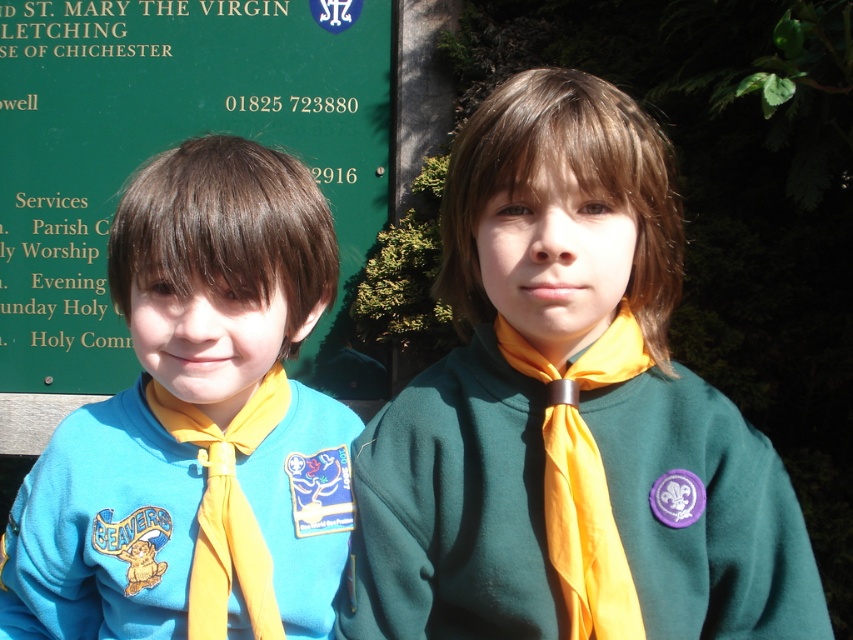
Identify the location of green fleece sweater at center. This screenshot has width=853, height=640. (567, 403).

Does green fleece sweater at center appear on the right side of yellow silky necktie at center?

Correct, you'll find green fleece sweater at center to the right of yellow silky necktie at center.

I want to click on green fleece sweater at center, so click(567, 403).

The image size is (853, 640). Find the location of `green fleece sweater at center`. green fleece sweater at center is located at coordinates (567, 403).

Between green fleece sweater at center and green signboard at upper left, which one is positioned higher?

green signboard at upper left

Which of these two, green fleece sweater at center or green signboard at upper left, stands shorter?

With less height is green fleece sweater at center.

Does point (608, 444) come closer to viewer compared to point (44, 182)?

Yes, it is.

At what (x,y) coordinates should I click in order to perform the action: click on green fleece sweater at center. Please return your answer as a coordinate pair (x, y). The width and height of the screenshot is (853, 640). Looking at the image, I should click on (567, 403).

Does matte blue sweatshirt at left come in front of green signboard at upper left?

Yes, matte blue sweatshirt at left is closer to the viewer.

Which is below, matte blue sweatshirt at left or green signboard at upper left?

Positioned lower is matte blue sweatshirt at left.

Find the location of a particular element. The height and width of the screenshot is (640, 853). matte blue sweatshirt at left is located at coordinates [x=196, y=417].